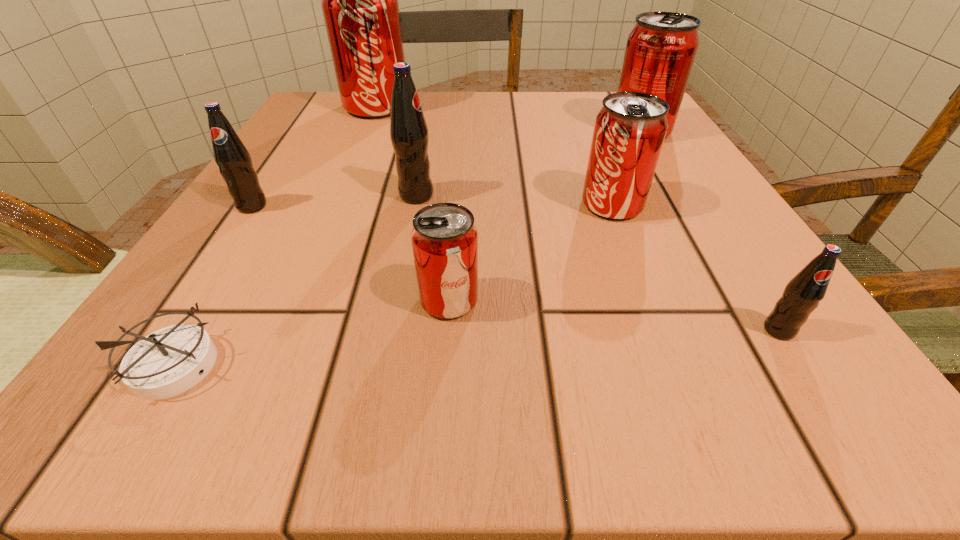
I want to click on the nearest red pop soda, so click(444, 238).

Locate an element on the screen. the smallest black pop is located at coordinates (802, 294).

Locate an element on the screen. This screenshot has width=960, height=540. the nearest black pop is located at coordinates (802, 294).

You are a GUI agent. You are given a task and a screenshot of the screen. Output one action in this format:
    pyautogui.click(x=<x>, y=<y>)
    Task: Click on the shortest object
    This screenshot has width=960, height=540.
    Given the screenshot: What is the action you would take?
    pyautogui.click(x=169, y=361)

Image resolution: width=960 pixels, height=540 pixels. Identify the location of blank space located 0.050m on the right of the second pop from left to right. (433, 107).

This screenshot has height=540, width=960. Find the location of `free space located 0.120m on the front label of the fourth object from left to right`. free space located 0.120m on the front label of the fourth object from left to right is located at coordinates (511, 195).

Find the location of a particular element. free space located on the left of the rightmost red pop soda is located at coordinates (435, 131).

Image resolution: width=960 pixels, height=540 pixels. Find the location of `free space located on the left of the second nearest red pop soda`. free space located on the left of the second nearest red pop soda is located at coordinates (324, 205).

Identify the location of free spot located on the front label of the leftmost pop. (204, 280).

Image resolution: width=960 pixels, height=540 pixels. Find the location of `vacant region located 0.100m on the left of the second red pop soda from left to right`. vacant region located 0.100m on the left of the second red pop soda from left to right is located at coordinates (335, 300).